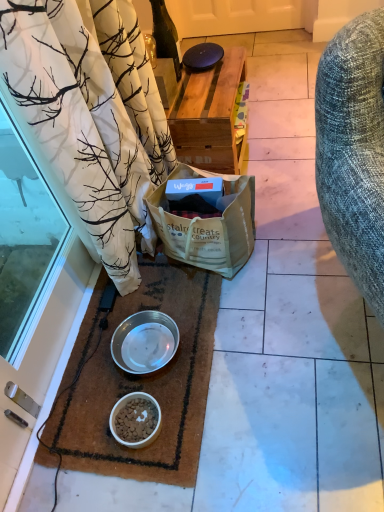
This screenshot has height=512, width=384. Find the location of `free space in front of white matte bowl at lower center, placed as the first bowl when sorted from bottom to top`. free space in front of white matte bowl at lower center, placed as the first bowl when sorted from bottom to top is located at coordinates (148, 468).